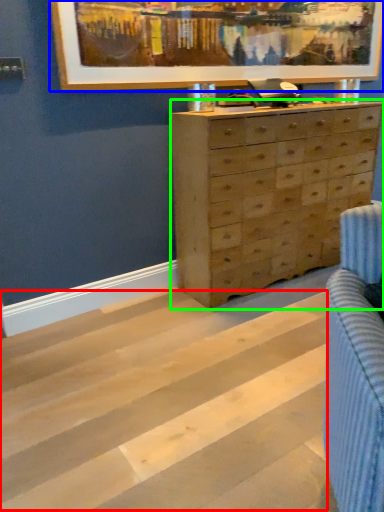
Question: Based on their relative distances, which object is nearer to stripe (highlighted by a red box)? Choose from picture frame (highlighted by a blue box) and chest of drawers (highlighted by a green box).

Choices:
 (A) picture frame
 (B) chest of drawers

Answer: (B)